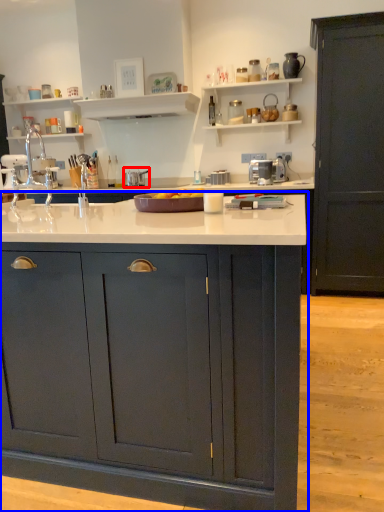
Question: Which object appears closest to the camera in this image, appliance (highlighted by a red box) or cabinetry (highlighted by a blue box)?

Choices:
 (A) appliance
 (B) cabinetry

Answer: (B)